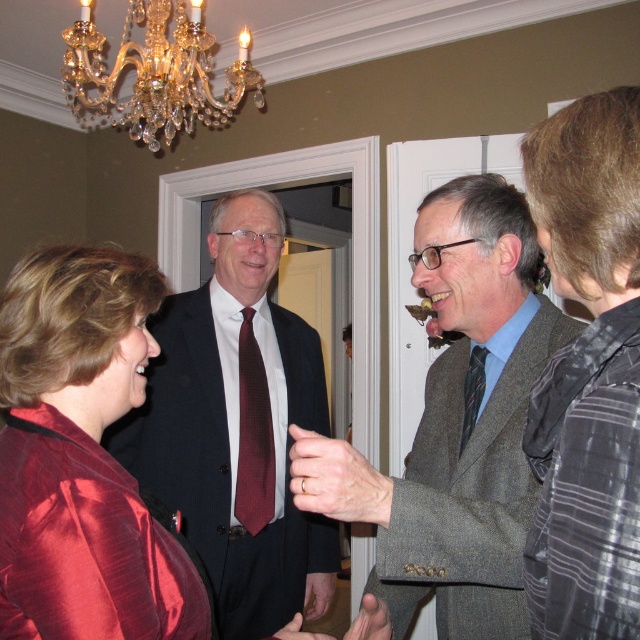
Question: Which is farther from the shiny red blouse at lower left?

Choices:
 (A) dark suit at center
 (B) textured brown suit at center
 (C) crystal gold chandelier at upper left
 (D) striped silk tie at center

Answer: (C)

Question: Can you confirm if shiny red blouse at lower left is wider than maroon textured tie at center?

Choices:
 (A) no
 (B) yes

Answer: (B)

Question: Does textured brown suit at center appear over gray striped shirt at right?

Choices:
 (A) yes
 (B) no

Answer: (B)

Question: From the image, what is the correct spatial relationship of dark suit at center in relation to crystal gold chandelier at upper left?

Choices:
 (A) left
 (B) right

Answer: (B)

Question: Among these objects, which one is nearest to the camera?

Choices:
 (A) striped silk tie at center
 (B) dark suit at center
 (C) maroon textured tie at center
 (D) crystal gold chandelier at upper left

Answer: (A)

Question: Which of the following is the closest to the observer?

Choices:
 (A) crystal gold chandelier at upper left
 (B) gray striped shirt at right
 (C) striped silk tie at center

Answer: (B)